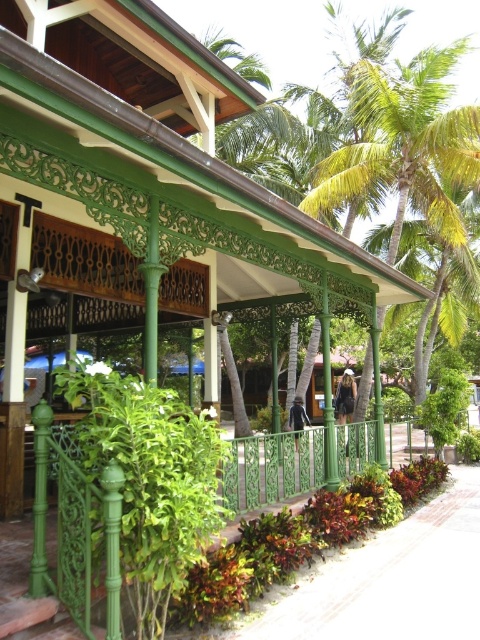
You are planning to place a 3m wide statue in the garden. The statue must be placed between the green leafy palm tree at center and the green wrought iron fence at lower left. Can the statue fit in the space between them?

The green leafy palm tree at center is narrower than the green wrought iron fence at lower left, but the description does not provide the actual distance between them. Therefore, it is impossible to determine if the 3m wide statue can fit in the space between them.

You are standing at the entrance of the building and see two points marked in the scene. The first point is at coordinates point (312, 205) and the second is at point (82, 502). Which point is closer to you?

Point (312, 205) is further to the camera than point (82, 502), so the point closer to you is point (82, 502).